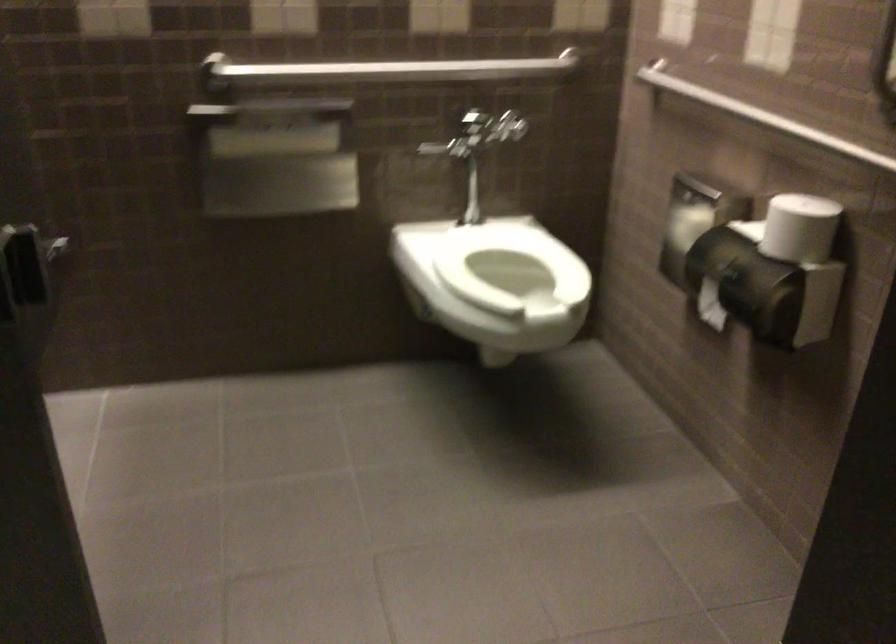
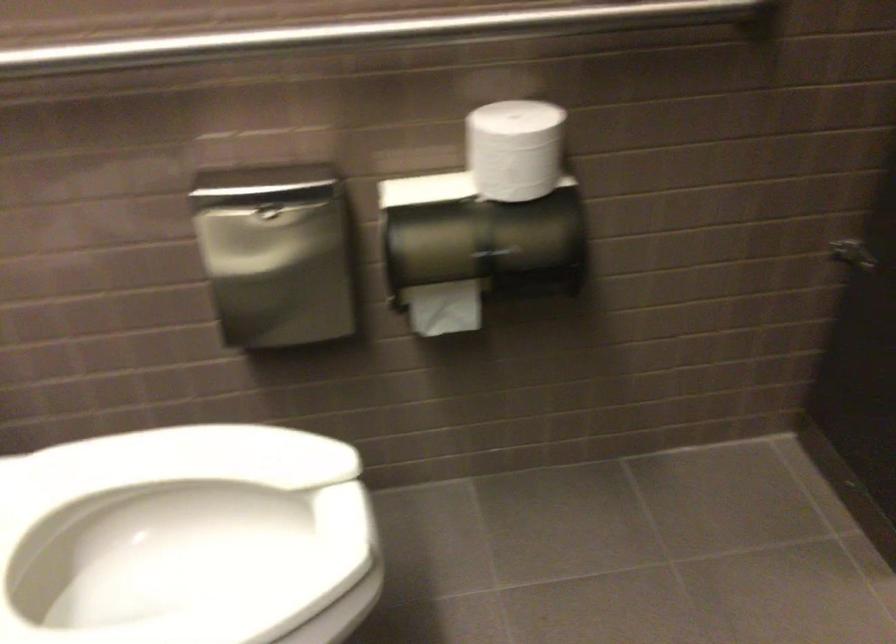
The point at (678, 219) is marked in the first image. Where is the corresponding point in the second image?

(277, 252)